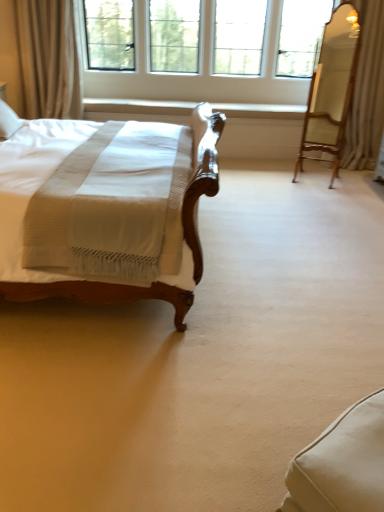
Question: Can you see clear glass window at upper center touching white fabric swivel chair at lower right, which is the 1th swivel chair from front to back?

Choices:
 (A) yes
 (B) no

Answer: (B)

Question: From the image's perspective, is clear glass window at upper center over white fabric swivel chair at lower right, which is the 1th swivel chair from front to back?

Choices:
 (A) no
 (B) yes

Answer: (B)

Question: Can you confirm if clear glass window at upper center is wider than white fabric swivel chair at lower right, positioned as the first swivel chair in bottom-to-top order?

Choices:
 (A) no
 (B) yes

Answer: (B)

Question: Is clear glass window at upper center positioned with its back to white fabric swivel chair at lower right, which is the second swivel chair from top to bottom?

Choices:
 (A) no
 (B) yes

Answer: (A)

Question: Is clear glass window at upper center in front of white fabric swivel chair at lower right, which is the second swivel chair from top to bottom?

Choices:
 (A) no
 (B) yes

Answer: (A)

Question: From the image's perspective, is clear glass window at upper center located beneath white fabric swivel chair at lower right, the 1th swivel chair viewed from the left?

Choices:
 (A) yes
 (B) no

Answer: (B)

Question: Is wooden swivel chair at right, which appears as the 2th swivel chair when viewed from the left, at the back of beige fabric curtain at upper left, arranged as the 1th curtain when viewed from the left?

Choices:
 (A) yes
 (B) no

Answer: (B)

Question: Does beige fabric curtain at upper left, arranged as the 1th curtain when viewed from the left, lie behind wooden swivel chair at right, marked as the first swivel chair in a back-to-front arrangement?

Choices:
 (A) no
 (B) yes

Answer: (B)

Question: Does beige fabric curtain at upper left, the second curtain viewed from the right, have a smaller size compared to wooden swivel chair at right, which ranks as the first swivel chair in top-to-bottom order?

Choices:
 (A) no
 (B) yes

Answer: (A)

Question: Considering the relative sizes of beige fabric curtain at upper left, the second curtain viewed from the right, and wooden swivel chair at right, which is counted as the second swivel chair, starting from the bottom, in the image provided, is beige fabric curtain at upper left, the second curtain viewed from the right, shorter than wooden swivel chair at right, which is counted as the second swivel chair, starting from the bottom,?

Choices:
 (A) yes
 (B) no

Answer: (A)

Question: Are beige fabric curtain at upper left, the second curtain viewed from the right, and wooden swivel chair at right, which is counted as the second swivel chair, starting from the bottom, located far from each other?

Choices:
 (A) no
 (B) yes

Answer: (B)

Question: Can you confirm if beige fabric curtain at upper left, arranged as the 1th curtain when viewed from the left, is bigger than wooden swivel chair at right, which ranks as the first swivel chair in right-to-left order?

Choices:
 (A) yes
 (B) no

Answer: (A)

Question: Can you confirm if clear glass window at upper center is wider than white textured curtain at upper right, the second curtain from the left?

Choices:
 (A) yes
 (B) no

Answer: (B)